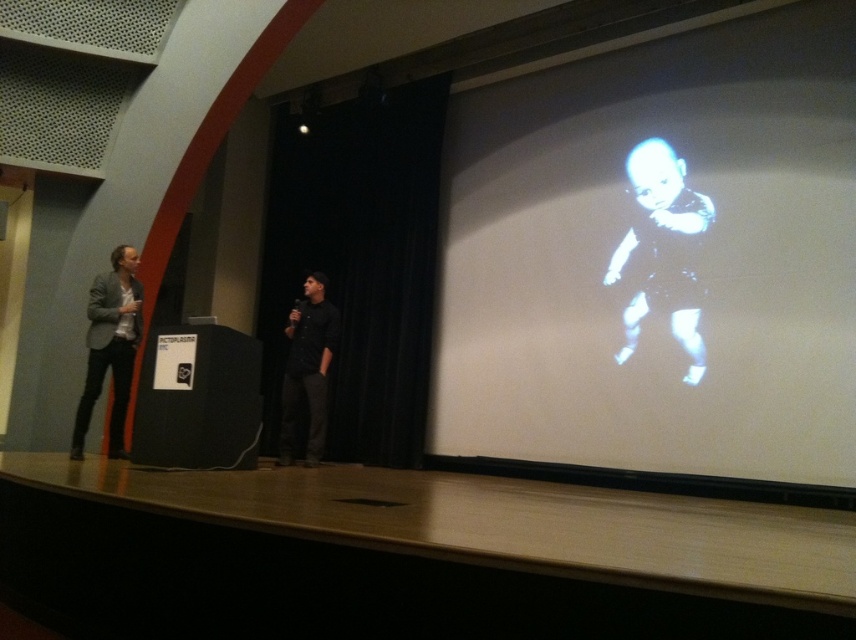
Question: Which of the following is the farthest from the observer?

Choices:
 (A) (640, 166)
 (B) (282, 410)
 (C) (116, 413)
 (D) (522, 230)

Answer: (D)

Question: Is white matte projection screen at upper right positioned at the back of dark gray suit at left?

Choices:
 (A) yes
 (B) no

Answer: (B)

Question: Which of the following is the farthest from the observer?

Choices:
 (A) [x=314, y=451]
 (B) [x=663, y=266]
 (C) [x=73, y=426]
 (D) [x=617, y=355]

Answer: (A)

Question: Which point is farther to the camera?

Choices:
 (A) black matte baby at upper right
 (B) black matte shirt at center

Answer: (B)

Question: Is the position of white matte projection screen at upper right less distant than that of dark gray suit at left?

Choices:
 (A) yes
 (B) no

Answer: (A)

Question: Does black matte baby at upper right come in front of dark gray suit at left?

Choices:
 (A) no
 (B) yes

Answer: (A)